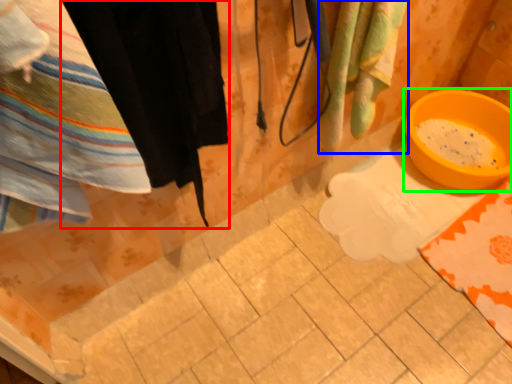
Question: Based on their relative distances, which object is nearer to clothing (highlighted by a red box)? Choose from beach towel (highlighted by a blue box) and basin (highlighted by a green box).

Choices:
 (A) beach towel
 (B) basin

Answer: (A)